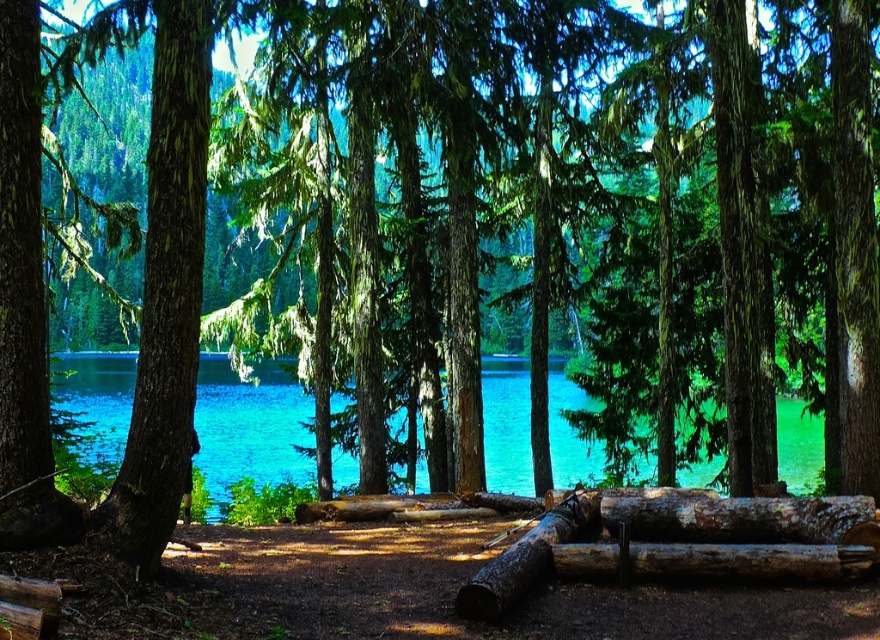
You are a hiker who wants to cross a small stream using the logs in the forest. You see the rusty wood log at center and the weathered brown log at center. Which log is located to the left when facing the stream?

The rusty wood log at center is positioned on the left side of weathered brown log at center, so when facing the stream, the rusty wood log at center is on the left.

You are a hiker who wants to cross the forest to reach the lake. You see the turquoise water at center and the brown rough log at center. Which direction should you head towards to reach the lake first?

The turquoise water at center is to the left of brown rough log at center, so you should head towards the left direction to reach the lake first.